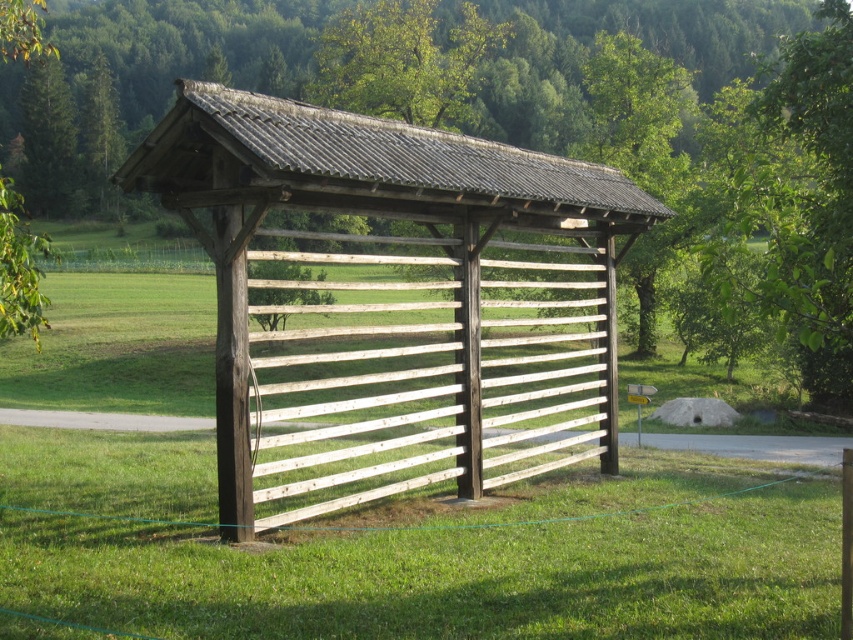
Is point (572, 582) positioned behind point (538, 83)?

That is False.

This screenshot has height=640, width=853. What do you see at coordinates (419, 548) in the screenshot?
I see `green grass at center` at bounding box center [419, 548].

Find the location of a particular element. green grass at center is located at coordinates (419, 548).

Between point (685, 518) and point (393, 456), which one is positioned behind?

Point (393, 456)

Is point (660, 612) positioned in front of point (352, 490)?

Yes, it is.

At what (x,y) coordinates should I click in order to perform the action: click on green grass at center. Please return your answer as a coordinate pair (x, y). This screenshot has width=853, height=640. Looking at the image, I should click on (419, 548).

Can you confirm if wooden slats at center is positioned to the right of green leafy tree at center?

Yes, wooden slats at center is to the right of green leafy tree at center.

Locate an element on the screen. The height and width of the screenshot is (640, 853). wooden slats at center is located at coordinates (393, 301).